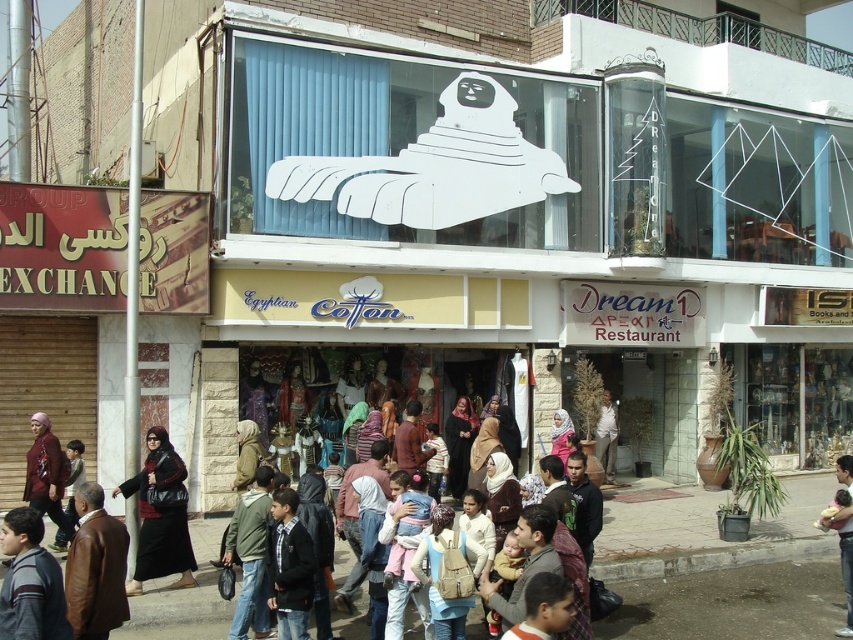
You are a customer in the Egyptian Cotton store and want to buy a leather item. You want to know which item is smaller between the brown leather jacket at lower left and the black leather abaya at center. Which one should you choose?

The brown leather jacket at lower left has a smaller size compared to the black leather abaya at center, so you should choose the brown leather jacket at lower left.

You are a customer entering the Egyptian Cotton store and see the brown leather jacket at lower left and the black leather abaya at center. Which item is closer to the entrance?

The brown leather jacket at lower left is closer to the entrance because it is positioned closer to the viewer than the black leather abaya at center.